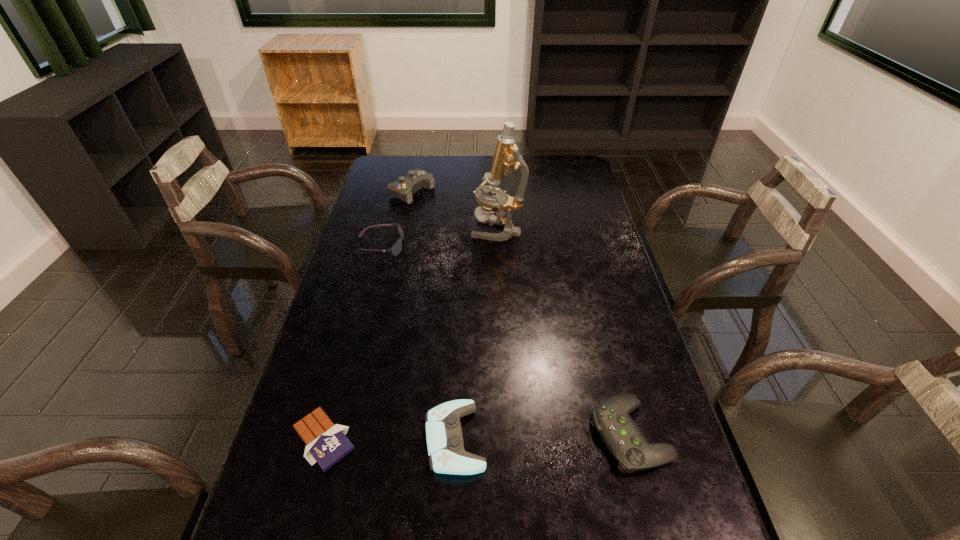
Locate an element on the screen. The height and width of the screenshot is (540, 960). free space that satisfies the following two spatial constraints: 1. on the back side of the rightmost control; 2. on the left side of the shortest object is located at coordinates (325, 435).

The image size is (960, 540). In order to click on free space that satisfies the following two spatial constraints: 1. on the back side of the second control from left to right; 2. on the left side of the microscope in this screenshot , I will do `click(465, 229)`.